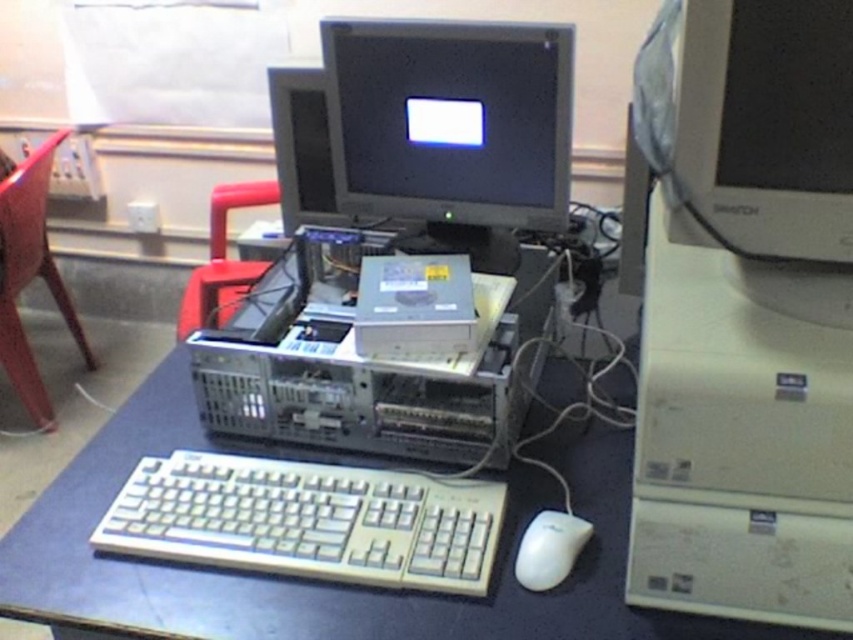
Where is the matte gray monitor at center located in the image?

The matte gray monitor at center is located at point (450, 120).

You are trying to locate two specific points on the desk in the workspace image. The first point is labeled as point (148, 589) and the second is point (215, 282). From your vantage point, which of these points is closer to you?

Point (148, 589) is in front of point (215, 282), so it is closer to you.

You are a technician trying to access the monitor controls. You see the matte gray monitor at center and the red plastic chair at left. Which object is physically nearer to you?

The matte gray monitor at center is closer to the viewer than the red plastic chair at left, so you should adjust the matte gray monitor at center first since it is nearer.